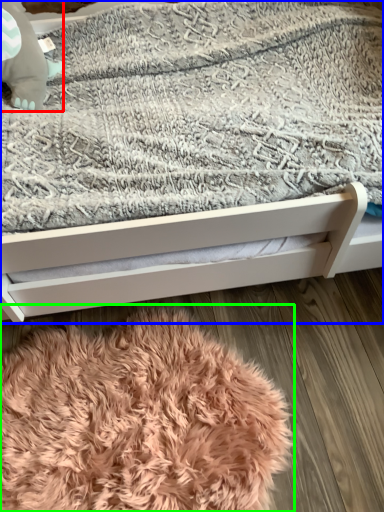
Question: Considering the real-world distances, which object is closest to baby elephant (highlighted by a red box)? bed (highlighted by a blue box) or blanket (highlighted by a green box).

Choices:
 (A) bed
 (B) blanket

Answer: (A)